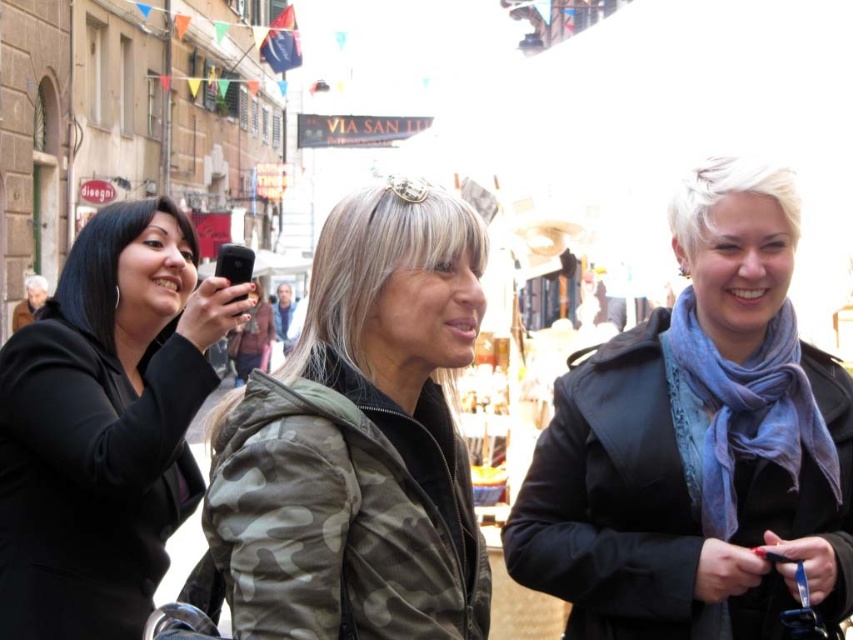
You are a photographer trying to capture a candid shot of the women in the scene. You notice the blue scarf at center and the black matte phone at left. Which object is closer to the right side of your frame?

The blue scarf at center is positioned on the right side of the black matte phone at left, so it is closer to the right side of the frame.